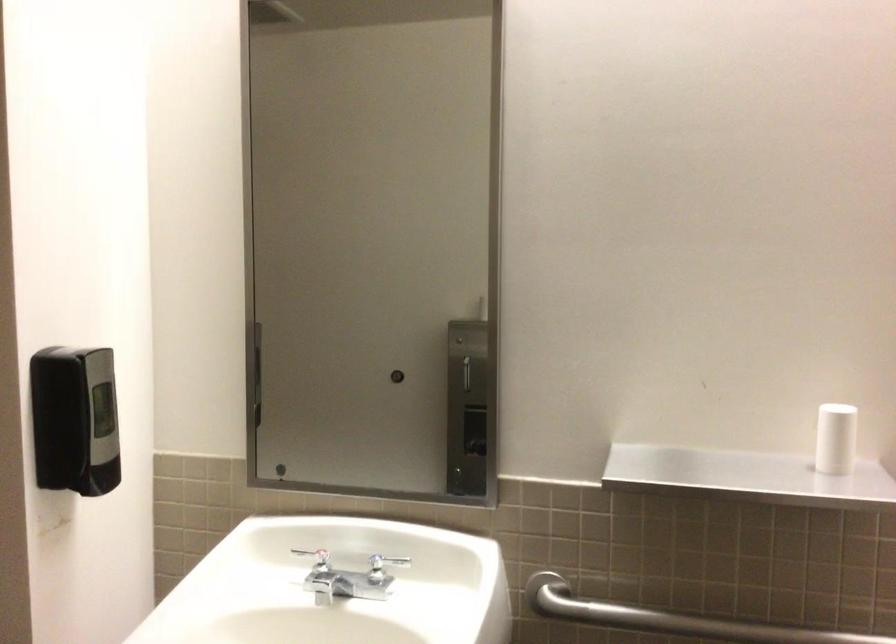
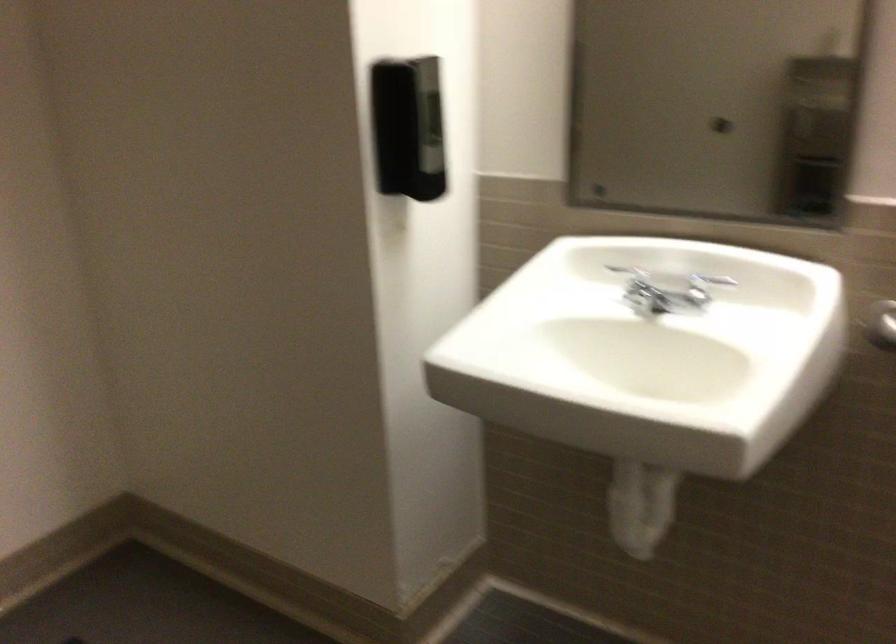
Where in the second image is the point corresponding to point (76, 428) from the first image?

(408, 128)